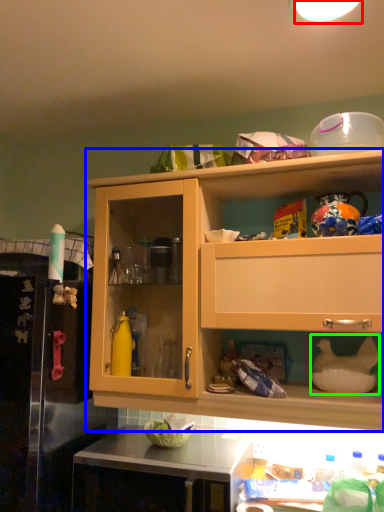
Question: Based on their relative distances, which object is nearer to lighting (highlighted by a red box)? Choose from cabinetry (highlighted by a blue box) and appliance (highlighted by a green box).

Choices:
 (A) cabinetry
 (B) appliance

Answer: (A)